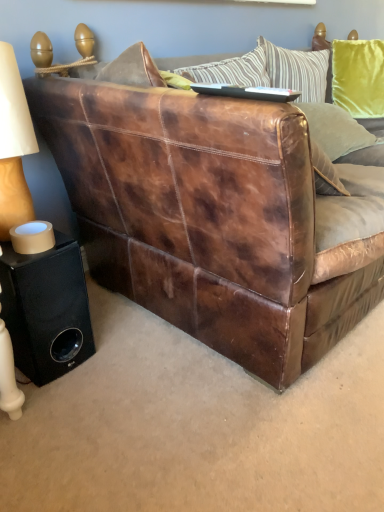
Question: Considering the relative positions of black matte speaker at lower left and matte beige lampshade at left in the image provided, is black matte speaker at lower left to the left or to the right of matte beige lampshade at left?

Choices:
 (A) left
 (B) right

Answer: (B)

Question: Is black matte speaker at lower left spatially inside matte beige lampshade at left, or outside of it?

Choices:
 (A) inside
 (B) outside

Answer: (B)

Question: Which object is the farthest from the brown leather couch at center?

Choices:
 (A) matte beige lampshade at left
 (B) velvet green pillow at upper right
 (C) black matte speaker at lower left

Answer: (B)

Question: Estimate the real-world distances between objects in this image. Which object is closer to the black matte speaker at lower left?

Choices:
 (A) matte beige lampshade at left
 (B) brown leather couch at center
 (C) velvet green pillow at upper right

Answer: (A)